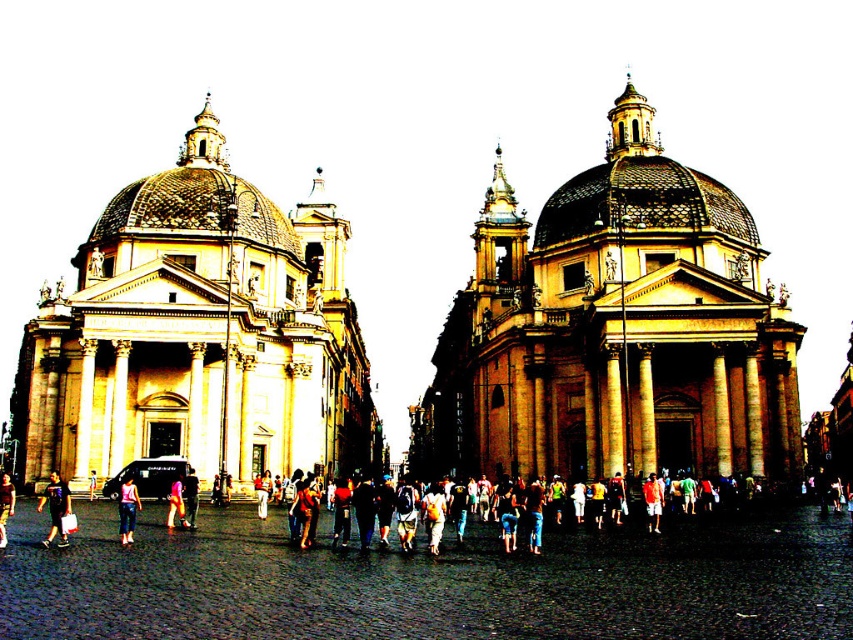
Can you confirm if brown cobblestone plaza at center is wider than light pink fabric dress at center?

Correct, the width of brown cobblestone plaza at center exceeds that of light pink fabric dress at center.

Is brown cobblestone plaza at center further to the viewer compared to light pink fabric dress at center?

No, it is not.

Which is in front, point (466, 634) or point (178, 506)?

Positioned in front is point (466, 634).

Locate an element on the screen. brown cobblestone plaza at center is located at coordinates (428, 580).

Does brown stone church at center appear over light pink fabric dress at center?

Correct, brown stone church at center is located above light pink fabric dress at center.

Does point (635, 440) come behind point (166, 516)?

That is True.

What do you see at coordinates (614, 332) in the screenshot?
I see `brown stone church at center` at bounding box center [614, 332].

Where is `brown stone church at center`? The image size is (853, 640). brown stone church at center is located at coordinates (614, 332).

Which is below, beige stone church at left or pink denim jeans at center?

Positioned lower is pink denim jeans at center.

Does beige stone church at left have a larger size compared to pink denim jeans at center?

Correct, beige stone church at left is larger in size than pink denim jeans at center.

Who is more forward, (138, 244) or (125, 513)?

Positioned in front is point (125, 513).

Image resolution: width=853 pixels, height=640 pixels. What are the coordinates of `beige stone church at left` in the screenshot? It's located at (199, 336).